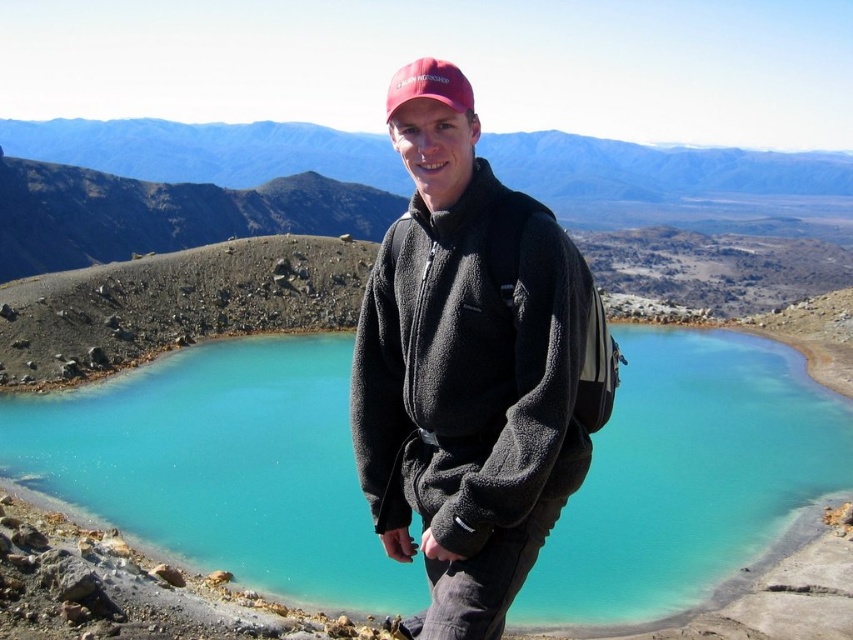
Question: Which object is closer to the camera taking this photo?

Choices:
 (A) turquoise glossy water at center
 (B) matte red baseball cap at upper center

Answer: (B)

Question: Does black fleece jacket at center appear on the left side of matte red baseball cap at upper center?

Choices:
 (A) no
 (B) yes

Answer: (A)

Question: Is turquoise glossy water at center to the left of black fleece jacket at center from the viewer's perspective?

Choices:
 (A) no
 (B) yes

Answer: (A)

Question: Among these points, which one is farthest from the camera?

Choices:
 (A) click(461, 72)
 (B) click(381, 605)
 (C) click(389, 230)

Answer: (B)

Question: Estimate the real-world distances between objects in this image. Which object is closer to the black fleece jacket at center?

Choices:
 (A) matte red baseball cap at upper center
 (B) turquoise glossy water at center

Answer: (A)

Question: Is black fleece jacket at center to the left of matte red baseball cap at upper center from the viewer's perspective?

Choices:
 (A) yes
 (B) no

Answer: (B)